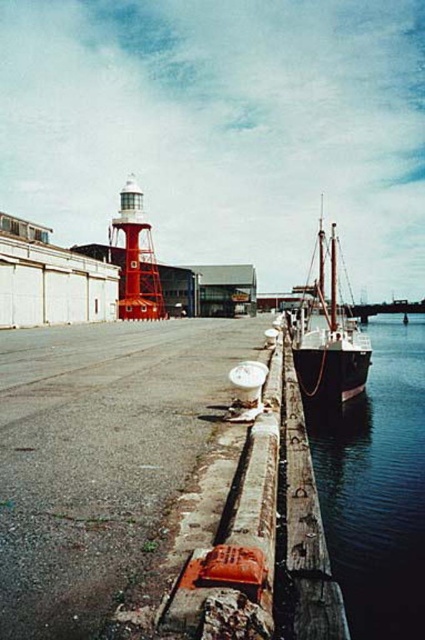
Question: Which point appears farthest from the camera in this image?

Choices:
 (A) (374, 513)
 (B) (314, 374)

Answer: (B)

Question: Is dark blue water at lower right smaller than wooden ship at right?

Choices:
 (A) no
 (B) yes

Answer: (B)

Question: Is dark blue water at lower right bigger than wooden ship at right?

Choices:
 (A) no
 (B) yes

Answer: (A)

Question: Is dark blue water at lower right thinner than wooden ship at right?

Choices:
 (A) yes
 (B) no

Answer: (A)